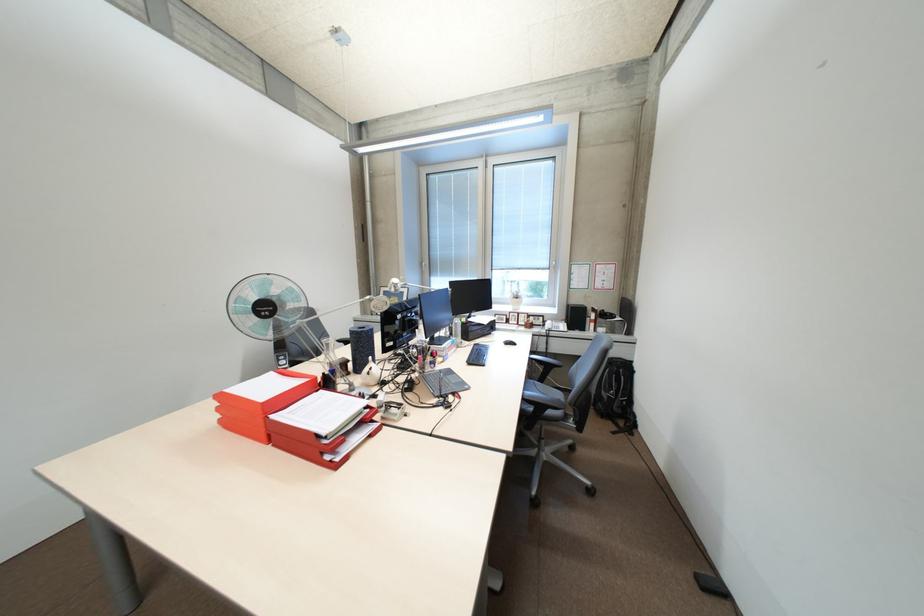
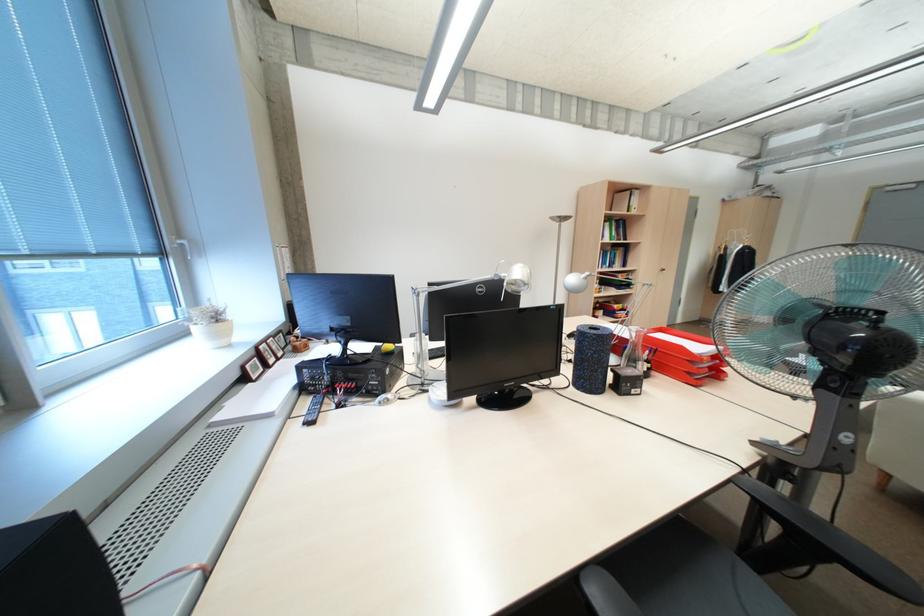
Question: I am providing you with two images of the same scene from different viewpoints. Please identify which objects are invisible in image2.

Choices:
 (A) blue foam roller
 (B) black keyboard
 (C) brown coffee mug
 (D) black fan dial

Answer: (B)